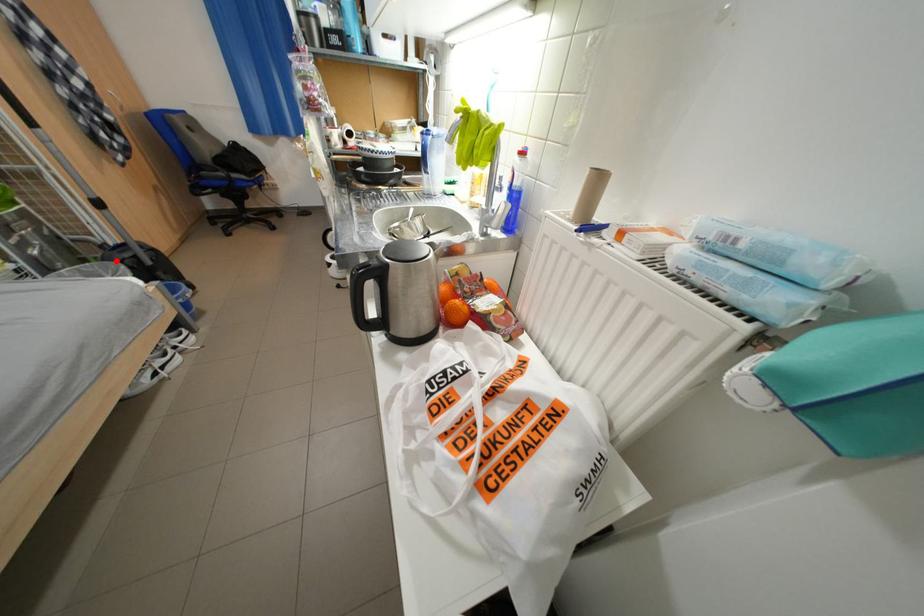
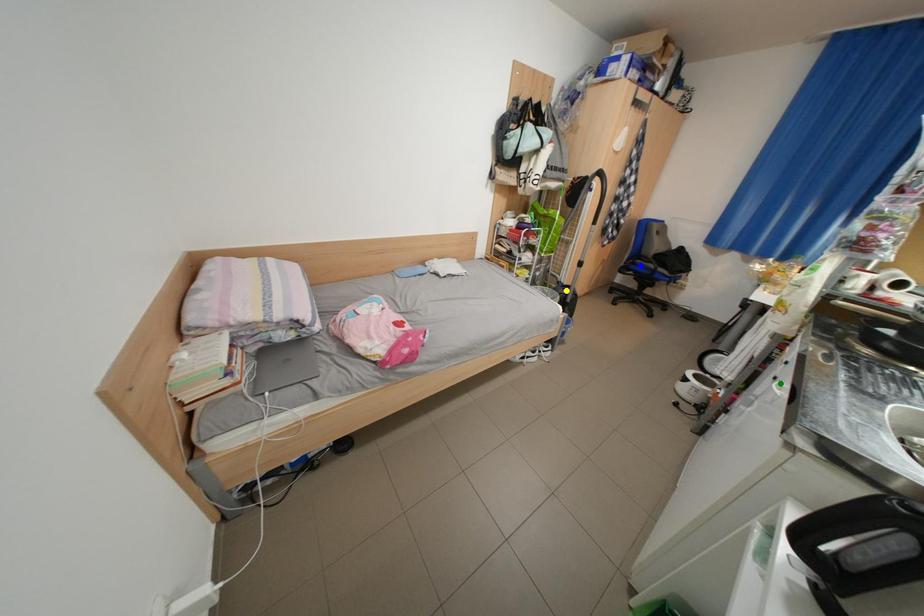
Question: I am providing you with two images of the same scene from different viewpoints. A red point is marked on the first image. You are given multiple points on the second image. Which point in image 2 represents the same 3d spot as the red point in image 1?

Choices:
 (A) green point
 (B) yellow point
 (C) blue point

Answer: (B)